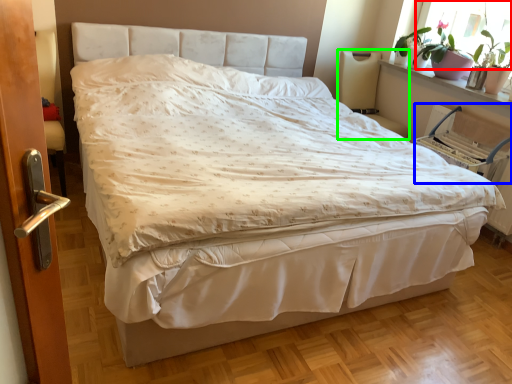
Question: Which object is the farthest from window screen (highlighted by a red box)? Choose among these: armchair (highlighted by a blue box) or armchair (highlighted by a green box).

Choices:
 (A) armchair
 (B) armchair

Answer: (B)